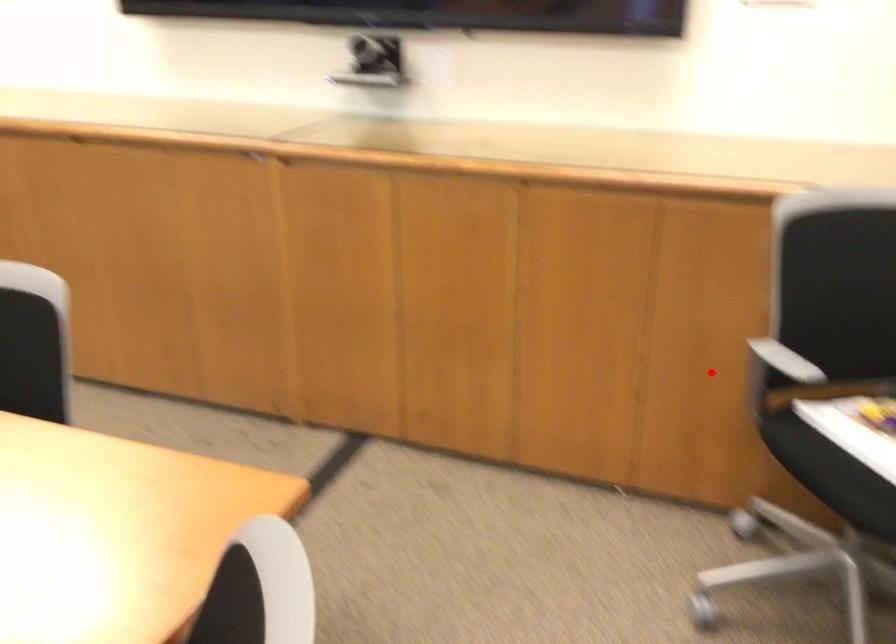
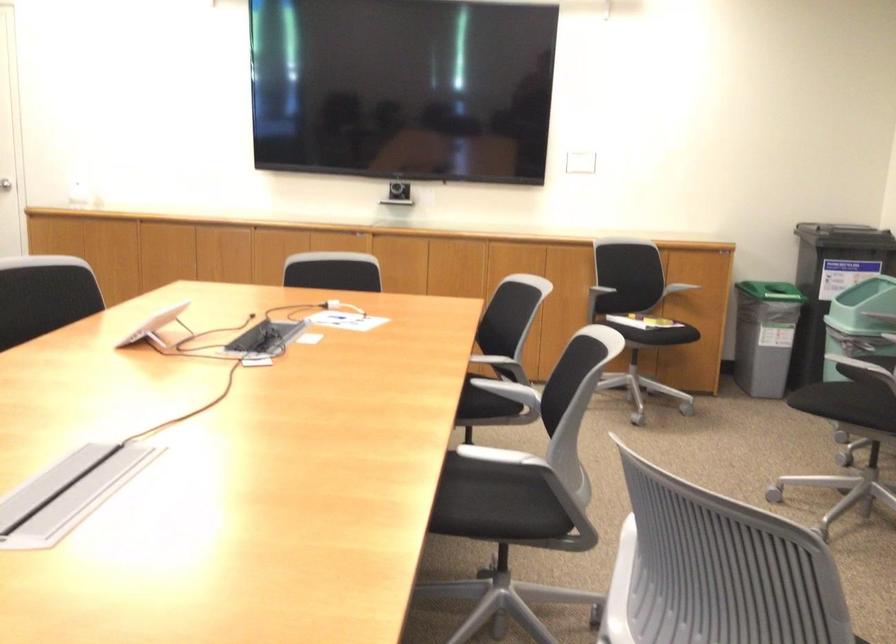
Locate, in the second image, the point that corresponds to the highlighted location in the first image.

(571, 290)